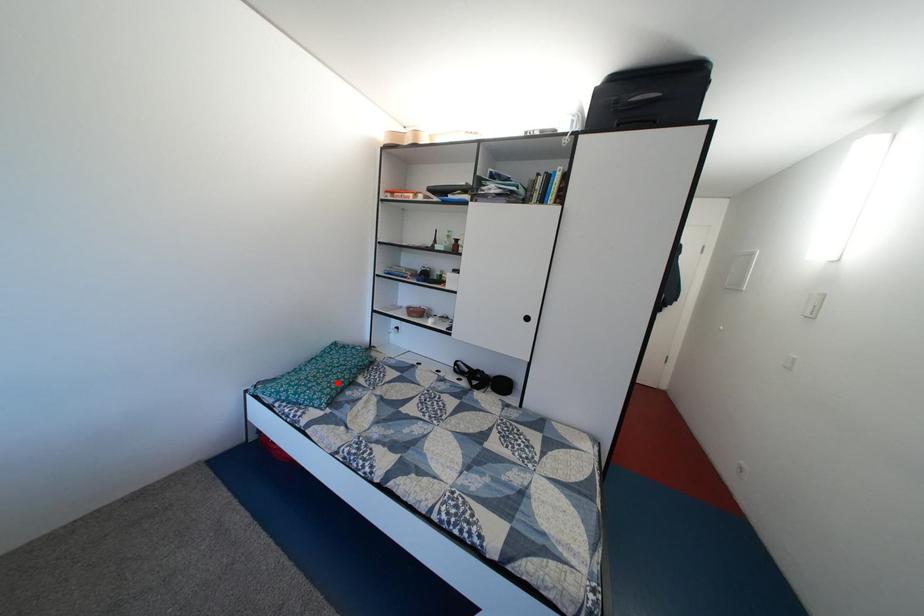
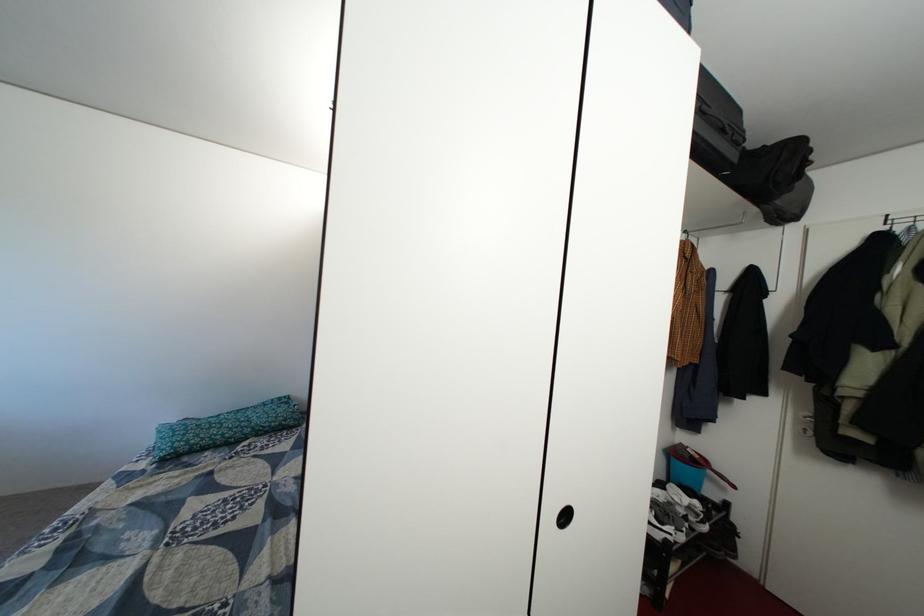
Locate, in the second image, the point that corresponds to the highlighted location in the first image.

(222, 435)